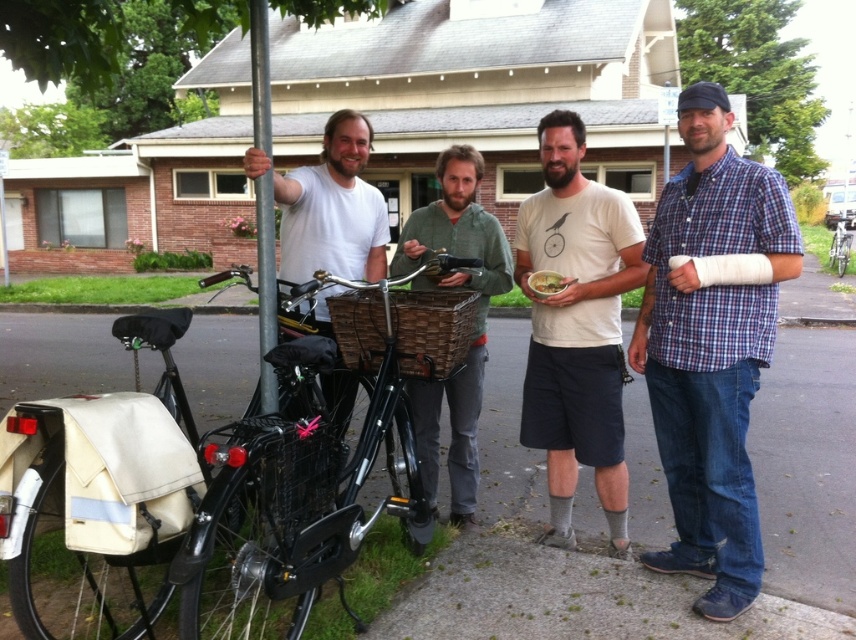
Between blue plaid shirt at right and white cotton t-shirt at center, which one appears on the right side from the viewer's perspective?

blue plaid shirt at right

Can you confirm if blue plaid shirt at right is positioned above white cotton t-shirt at center?

Incorrect, blue plaid shirt at right is not positioned above white cotton t-shirt at center.

Between point (715, 609) and point (593, 442), which one is positioned in front?

Point (715, 609)

Identify the location of blue plaid shirt at right. (711, 348).

Is matte white t-shirt at left taller than silver metallic bicycle at right?

No, matte white t-shirt at left is not taller than silver metallic bicycle at right.

Between matte white t-shirt at left and silver metallic bicycle at right, which one is positioned lower?

Positioned lower is matte white t-shirt at left.

Between point (245, 157) and point (843, 236), which one is positioned behind?

The point (843, 236) is behind.

This screenshot has width=856, height=640. In order to click on matte white t-shirt at left in this screenshot , I will do `click(333, 209)`.

Between green woven basket at center and matte white t-shirt at left, which one is positioned lower?

green woven basket at center is lower down.

Is green woven basket at center smaller than matte white t-shirt at left?

No, green woven basket at center is not smaller than matte white t-shirt at left.

Image resolution: width=856 pixels, height=640 pixels. I want to click on green woven basket at center, so click(474, 320).